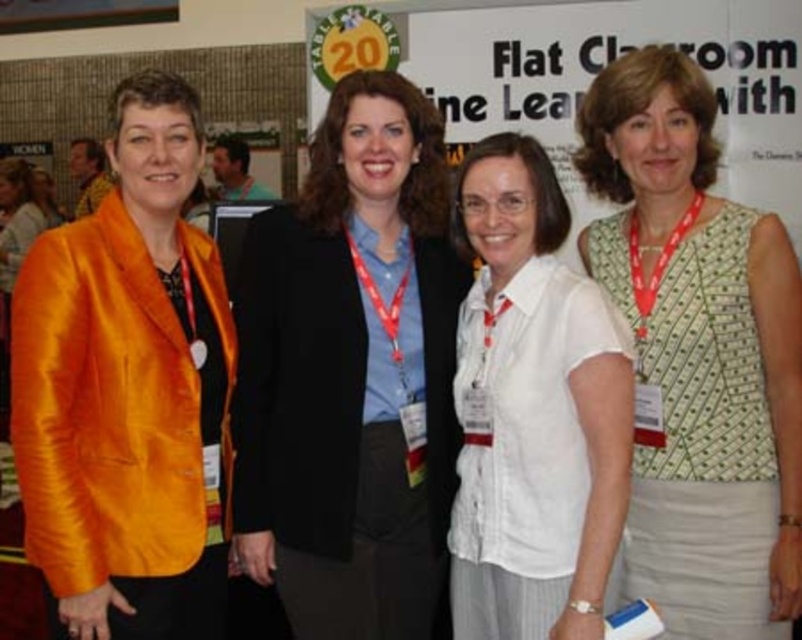
Question: Is matte black blazer at center wider than satin orange blazer at left?

Choices:
 (A) no
 (B) yes

Answer: (B)

Question: Can you confirm if matte black blazer at center is bigger than white cotton shirt at center?

Choices:
 (A) yes
 (B) no

Answer: (A)

Question: Which object is the closest to the white cotton shirt at center?

Choices:
 (A) matte black blazer at center
 (B) green dotted vest at center
 (C) satin orange blazer at left

Answer: (A)

Question: Does matte black blazer at center appear on the left side of satin orange blazer at left?

Choices:
 (A) yes
 (B) no

Answer: (B)

Question: Which object appears closest to the camera in this image?

Choices:
 (A) green dotted vest at center
 (B) matte black blazer at center
 (C) satin orange blazer at left
 (D) white cotton shirt at center

Answer: (D)

Question: Which point is closer to the camera?

Choices:
 (A) (647, 188)
 (B) (192, 586)
 (C) (322, 216)
 (D) (553, 246)

Answer: (D)